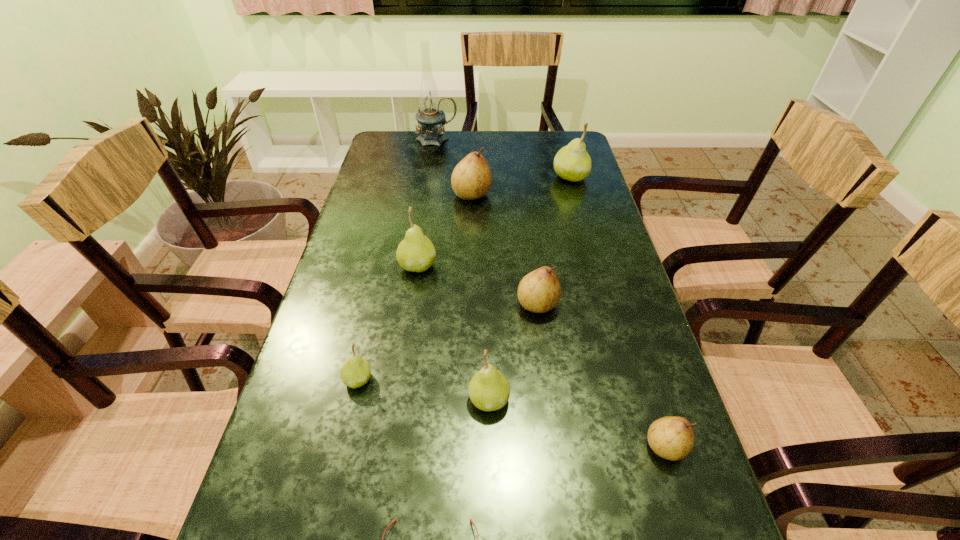
Find the location of a particular element. the third green pear from left to right is located at coordinates coord(489,390).

The image size is (960, 540). I want to click on the smallest brown pear, so click(x=671, y=437).

You are a GUI agent. You are given a task and a screenshot of the screen. Output one action in this format:
    pyautogui.click(x=<x>, y=<y>)
    Task: Click on the nearest pear
    The width and height of the screenshot is (960, 540).
    Given the screenshot: What is the action you would take?
    pos(671,437)

Identify the location of the smallest green pear. (356, 372).

Find the location of a particular element. the leftmost green pear is located at coordinates (356, 372).

Where is `free space located 0.130m on the right of the tallest object`? This screenshot has width=960, height=540. free space located 0.130m on the right of the tallest object is located at coordinates (493, 139).

You are a GUI agent. You are given a task and a screenshot of the screen. Output one action in this format:
    pyautogui.click(x=<x>, y=<y>)
    Task: Click on the vacant space located 0.070m on the left of the tallest pear
    
    Given the screenshot: What is the action you would take?
    pyautogui.click(x=531, y=177)

This screenshot has height=540, width=960. Find the location of `vacant space located on the right of the biggest brown pear`. vacant space located on the right of the biggest brown pear is located at coordinates (566, 195).

Image resolution: width=960 pixels, height=540 pixels. In order to click on free space located on the back of the second green pear from left to right in this screenshot , I will do `click(428, 197)`.

Where is `vacant point located 0.050m on the left of the third object from right to left`? Image resolution: width=960 pixels, height=540 pixels. vacant point located 0.050m on the left of the third object from right to left is located at coordinates (495, 305).